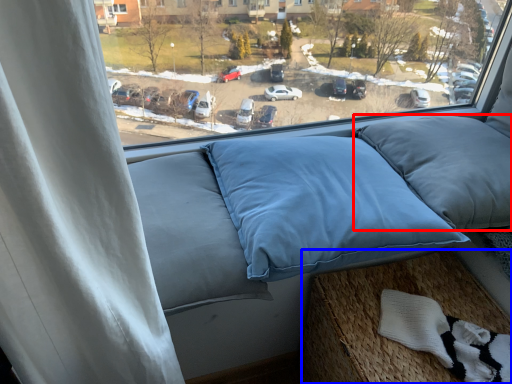
Question: Which point is closer to the camera, pillow (highlighted by a red box) or bed frame (highlighted by a blue box)?

Choices:
 (A) pillow
 (B) bed frame

Answer: (B)